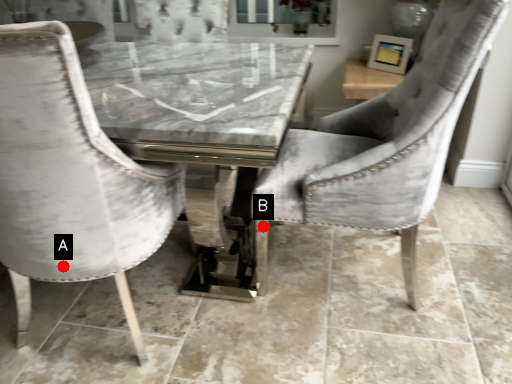
Question: Two points are circled on the image, labeled by A and B beside each circle. Which of the following is the farthest from the observer?

Choices:
 (A) A is further
 (B) B is further

Answer: (B)